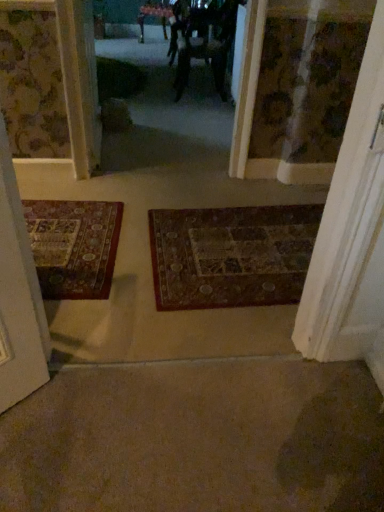
Question: From the image's perspective, is dark brown woven mat at center located above wooden door at right?

Choices:
 (A) no
 (B) yes

Answer: (A)

Question: From a real-world perspective, is dark brown woven mat at center located higher than wooden door at right?

Choices:
 (A) no
 (B) yes

Answer: (A)

Question: From a real-world perspective, is dark brown woven mat at center located beneath wooden door at right?

Choices:
 (A) yes
 (B) no

Answer: (A)

Question: From the image's perspective, does dark brown woven mat at center appear lower than wooden door at right?

Choices:
 (A) yes
 (B) no

Answer: (A)

Question: Does dark brown woven mat at center have a lesser width compared to wooden door at right?

Choices:
 (A) no
 (B) yes

Answer: (A)

Question: From the image's perspective, is dark fabric couple at center located above or below wooden door at right?

Choices:
 (A) below
 (B) above

Answer: (B)

Question: Considering their positions, is dark fabric couple at center located in front of or behind wooden door at right?

Choices:
 (A) front
 (B) behind

Answer: (B)

Question: From their relative heights in the image, would you say dark fabric couple at center is taller or shorter than wooden door at right?

Choices:
 (A) tall
 (B) short

Answer: (B)

Question: Does point (221, 98) appear closer or farther from the camera than point (380, 150)?

Choices:
 (A) farther
 (B) closer

Answer: (A)

Question: In terms of width, does metallic silver mirror at upper center look wider or thinner when compared to dark fabric couple at center?

Choices:
 (A) thin
 (B) wide

Answer: (B)

Question: Does point (158, 14) appear closer or farther from the camera than point (178, 27)?

Choices:
 (A) farther
 (B) closer

Answer: (A)

Question: Is metallic silver mirror at upper center situated inside dark fabric couple at center or outside?

Choices:
 (A) outside
 (B) inside

Answer: (A)

Question: Considering the relative positions of metallic silver mirror at upper center and dark fabric couple at center in the image provided, is metallic silver mirror at upper center to the left or to the right of dark fabric couple at center?

Choices:
 (A) right
 (B) left

Answer: (B)

Question: In terms of width, does dark brown woven mat at center look wider or thinner when compared to metallic silver mirror at upper center?

Choices:
 (A) thin
 (B) wide

Answer: (B)

Question: Does point (218, 283) appear closer or farther from the camera than point (140, 31)?

Choices:
 (A) farther
 (B) closer

Answer: (B)